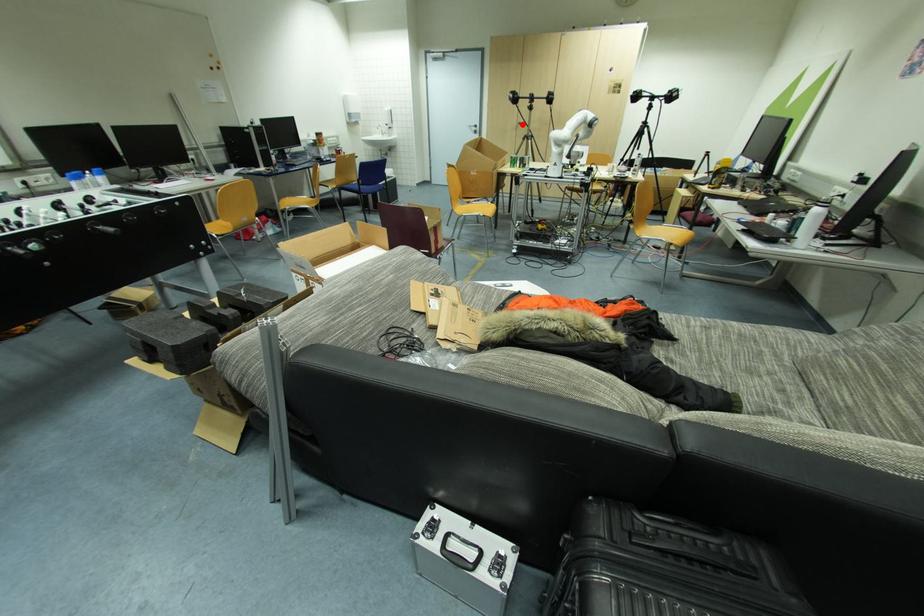
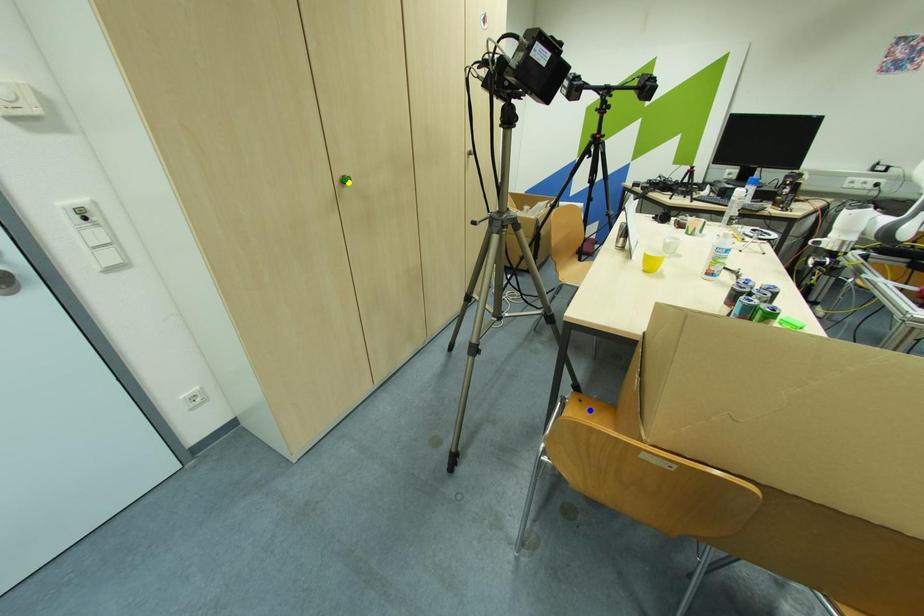
Question: I am providing you with two images of the same scene from different viewpoints. A red point is marked on the first image. You are given multiple points on the second image. Which spot in image 2 lines up with the point in image 1?

Choices:
 (A) yellow point
 (B) blue point
 (C) green point

Answer: (A)